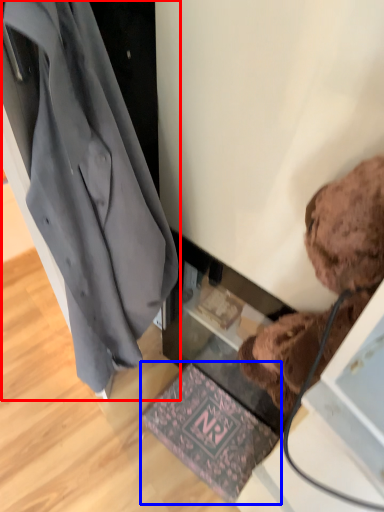
Question: Which point is closer to the camera, coat (highlighted by a red box) or mat (highlighted by a blue box)?

Choices:
 (A) coat
 (B) mat

Answer: (A)